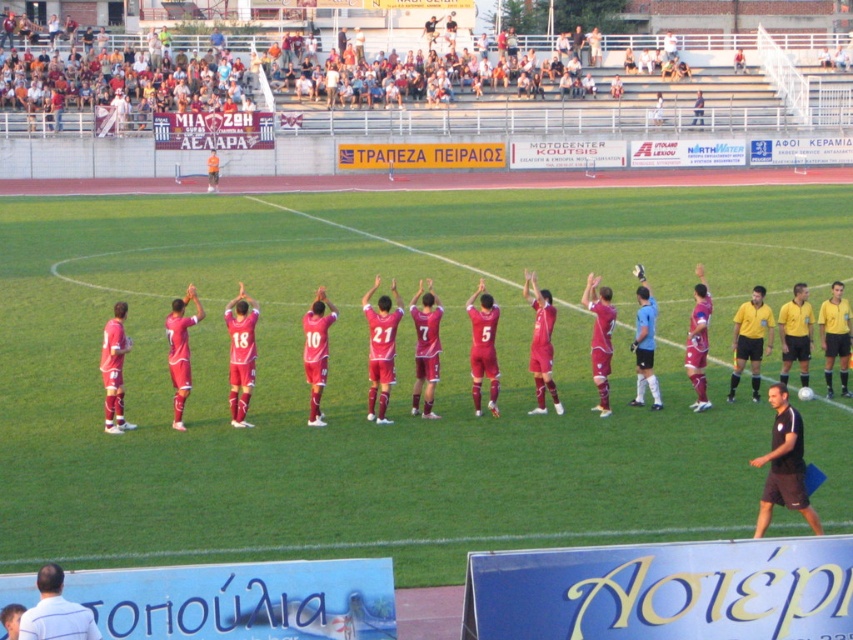
Question: Which point appears closest to the camera in this image?

Choices:
 (A) (322, 291)
 (B) (785, 433)

Answer: (B)

Question: Is the position of black short at lower right more distant than that of matte red soccer uniform at center?

Choices:
 (A) no
 (B) yes

Answer: (A)

Question: Observing the image, what is the correct spatial positioning of black short at lower right in reference to white shirt at lower left?

Choices:
 (A) below
 (B) above

Answer: (B)

Question: Which object is the closest to the matte red soccer uniform at center?

Choices:
 (A) white shirt at lower left
 (B) black short at lower right

Answer: (B)

Question: Which point is closer to the camera?

Choices:
 (A) (799, 477)
 (B) (672, 346)
 (C) (55, 625)

Answer: (C)

Question: Does black short at lower right appear on the left side of matte red soccer uniform at center?

Choices:
 (A) no
 (B) yes

Answer: (A)